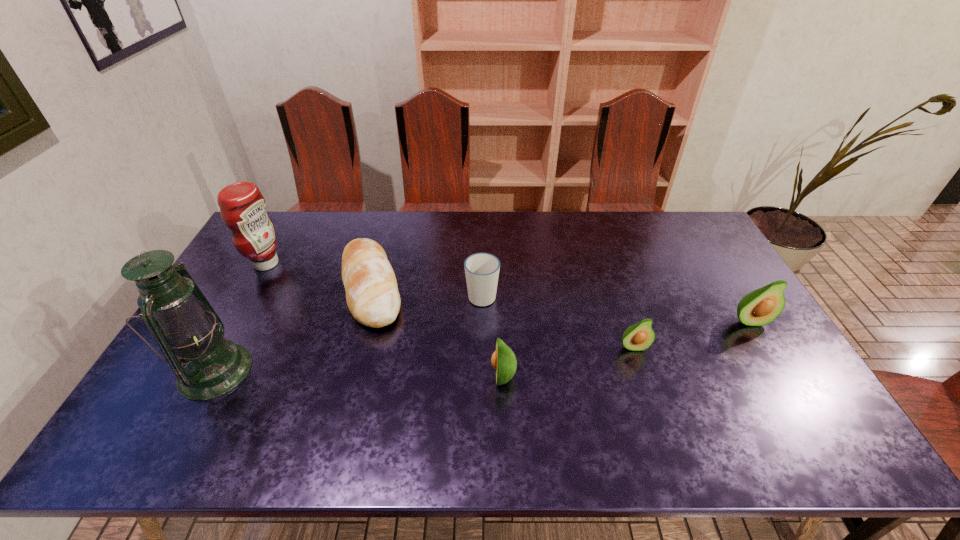
In the image, there is a desktop. At what (x,y) coordinates should I click in order to perform the action: click on vacant space at the left edge. Please return your answer as a coordinate pair (x, y). This screenshot has width=960, height=540. Looking at the image, I should click on (241, 280).

This screenshot has height=540, width=960. In the image, there is a desktop. Find the location of `free region at the right edge`. free region at the right edge is located at coordinates (757, 336).

This screenshot has width=960, height=540. Identify the location of vacant space at the far left corner of the desktop. (298, 218).

Where is `vacant space at the far right corner of the desktop`? vacant space at the far right corner of the desktop is located at coordinates (685, 240).

Where is `free space between the rightmost avocado and the second object from right to left`? This screenshot has width=960, height=540. free space between the rightmost avocado and the second object from right to left is located at coordinates (691, 334).

Find the location of a particular element. This screenshot has width=960, height=540. vacant space that is in between the rightmost object and the sixth shortest object is located at coordinates (508, 292).

Where is `empty space that is in between the leftmost avocado and the fifth object from right to left`? This screenshot has height=540, width=960. empty space that is in between the leftmost avocado and the fifth object from right to left is located at coordinates (438, 332).

At what (x,y) coordinates should I click in order to perform the action: click on free spot between the rightmost avocado and the third object from left to right. Please return your answer as a coordinate pair (x, y). Looking at the image, I should click on (560, 305).

Find the location of a particular element. The image size is (960, 540). vacant space that is in between the cup and the second shortest avocado is located at coordinates click(492, 335).

In order to click on unoccupied position between the second nearest avocado and the condiment in this screenshot , I will do coord(449,305).